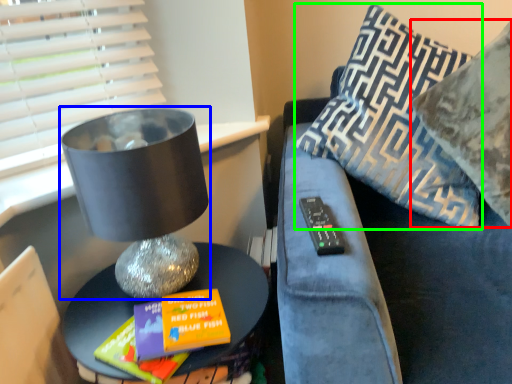
Question: Estimate the real-world distances between objects in this image. Which object is farther from pillow (highlighted by a red box), table lamp (highlighted by a blue box) or pillow (highlighted by a green box)?

Choices:
 (A) table lamp
 (B) pillow

Answer: (A)